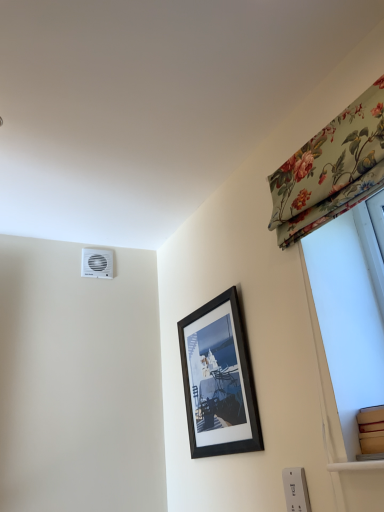
Image resolution: width=384 pixels, height=512 pixels. What do you see at coordinates (296, 490) in the screenshot?
I see `white plastic electric outlet at lower right` at bounding box center [296, 490].

In order to face white plastic air conditioning unit at upper left, should I rotate leftwards or rightwards?

To align with it, rotate left about 12.483°.

What do you see at coordinates (218, 380) in the screenshot? Image resolution: width=384 pixels, height=512 pixels. I see `black matte picture frame at center` at bounding box center [218, 380].

Find the location of a particular element. The width and height of the screenshot is (384, 512). floral fabric curtain at upper right is located at coordinates (331, 170).

Identify the location of white plastic electric outlet at lower right. (296, 490).

Can you tell me how much floral fabric curtain at upper right and black matte picture frame at center differ in facing direction?

The angular difference between floral fabric curtain at upper right and black matte picture frame at center is 0.0802 degrees.

Is floral fabric curtain at upper right positioned beyond the bounds of black matte picture frame at center?

Yes, floral fabric curtain at upper right is not within black matte picture frame at center.

Does floral fabric curtain at upper right come behind black matte picture frame at center?

No, floral fabric curtain at upper right is in front of black matte picture frame at center.

From the image's perspective, does floral fabric curtain at upper right appear higher than white plastic air conditioning unit at upper left?

Yes, from the image's perspective, floral fabric curtain at upper right is over white plastic air conditioning unit at upper left.

Which of these two, floral fabric curtain at upper right or white plastic air conditioning unit at upper left, is bigger?

floral fabric curtain at upper right is bigger.

Where is `air conditioning that appears on the left of floral fabric curtain at upper right`? The image size is (384, 512). air conditioning that appears on the left of floral fabric curtain at upper right is located at coordinates (97, 263).

Is point (220, 438) closer to camera compared to point (296, 490)?

No, (220, 438) is behind (296, 490).

Is white plastic electric outlet at lower right at the back of black matte picture frame at center?

That's not correct — black matte picture frame at center is not looking away from white plastic electric outlet at lower right.

Is black matte picture frame at center to the left or to the right of white plastic electric outlet at lower right in the image?

black matte picture frame at center is to the left of white plastic electric outlet at lower right.

Is white plastic electric outlet at lower right directly adjacent to white plastic air conditioning unit at upper left?

white plastic electric outlet at lower right is not next to white plastic air conditioning unit at upper left, and they're not touching.

Is white plastic electric outlet at lower right further to the viewer compared to white plastic air conditioning unit at upper left?

No.

Which is more to the right, white plastic electric outlet at lower right or white plastic air conditioning unit at upper left?

white plastic electric outlet at lower right is more to the right.

Considering the sizes of white plastic electric outlet at lower right and white plastic air conditioning unit at upper left in the image, is white plastic electric outlet at lower right wider or thinner than white plastic air conditioning unit at upper left?

white plastic electric outlet at lower right is thinner than white plastic air conditioning unit at upper left.

Consider the image. Considering the sizes of objects white plastic air conditioning unit at upper left and white plastic electric outlet at lower right in the image provided, who is thinner, white plastic air conditioning unit at upper left or white plastic electric outlet at lower right?

white plastic electric outlet at lower right is thinner.

This screenshot has height=512, width=384. I want to click on air conditioning behind the white plastic electric outlet at lower right, so click(97, 263).

Looking at the image, does white plastic air conditioning unit at upper left seem bigger or smaller compared to white plastic electric outlet at lower right?

Clearly, white plastic air conditioning unit at upper left is larger in size than white plastic electric outlet at lower right.

Which point is more forward, (95, 272) or (289, 223)?

The point (289, 223) is in front.

Is white plastic air conditioning unit at upper left in contact with floral fabric curtain at upper right?

→ No, white plastic air conditioning unit at upper left is not with floral fabric curtain at upper right.

Is white plastic air conditioning unit at upper left facing towards floral fabric curtain at upper right?

Yes, white plastic air conditioning unit at upper left faces towards floral fabric curtain at upper right.

Could you measure the distance between white plastic air conditioning unit at upper left and floral fabric curtain at upper right?

white plastic air conditioning unit at upper left and floral fabric curtain at upper right are 1.26 meters apart.

Considering the sizes of objects white plastic electric outlet at lower right and floral fabric curtain at upper right in the image provided, who is thinner, white plastic electric outlet at lower right or floral fabric curtain at upper right?

With smaller width is white plastic electric outlet at lower right.

Where is `curtain that appears on the right of white plastic electric outlet at lower right`? curtain that appears on the right of white plastic electric outlet at lower right is located at coordinates (331, 170).

Which is in front, white plastic electric outlet at lower right or floral fabric curtain at upper right?

floral fabric curtain at upper right is closer to the camera.

Is point (291, 496) behind point (382, 144)?

Yes, point (291, 496) is farther from viewer.

Locate an element on the screen. Image resolution: width=384 pixels, height=512 pixels. curtain that appears on the right of black matte picture frame at center is located at coordinates [x=331, y=170].

This screenshot has width=384, height=512. Find the location of `air conditioning positioned vertically above the floral fabric curtain at upper right (from a real-world perspective)`. air conditioning positioned vertically above the floral fabric curtain at upper right (from a real-world perspective) is located at coordinates (97, 263).

Looking at the image, which one is located closer to white plastic electric outlet at lower right, black matte picture frame at center or floral fabric curtain at upper right?

Among the two, black matte picture frame at center is located nearer to white plastic electric outlet at lower right.

When comparing their distances from black matte picture frame at center, does floral fabric curtain at upper right or white plastic air conditioning unit at upper left seem further?

white plastic air conditioning unit at upper left is positioned further to the anchor black matte picture frame at center.

Consider the image. Estimate the real-world distances between objects in this image. Which object is closer to white plastic electric outlet at lower right, floral fabric curtain at upper right or black matte picture frame at center?

black matte picture frame at center is closer to white plastic electric outlet at lower right.

Considering their positions, is white plastic air conditioning unit at upper left positioned closer to white plastic electric outlet at lower right than black matte picture frame at center?

Based on the image, black matte picture frame at center appears to be nearer to white plastic electric outlet at lower right.

Looking at the image, which one is located further to floral fabric curtain at upper right, black matte picture frame at center or white plastic air conditioning unit at upper left?

Among the two, white plastic air conditioning unit at upper left is located further to floral fabric curtain at upper right.

From the image, which object appears to be nearer to floral fabric curtain at upper right, black matte picture frame at center or white plastic electric outlet at lower right?

black matte picture frame at center is positioned closer to the anchor floral fabric curtain at upper right.

Based on their spatial positions, is black matte picture frame at center or white plastic air conditioning unit at upper left further from white plastic electric outlet at lower right?

Among the two, white plastic air conditioning unit at upper left is located further to white plastic electric outlet at lower right.

Looking at this image, estimate the real-world distances between objects in this image. Which object is closer to white plastic air conditioning unit at upper left, white plastic electric outlet at lower right or black matte picture frame at center?

black matte picture frame at center is closer to white plastic air conditioning unit at upper left.

At what (x,y) coordinates should I click in order to perform the action: click on picture frame between floral fabric curtain at upper right and white plastic electric outlet at lower right from top to bottom. Please return your answer as a coordinate pair (x, y). Looking at the image, I should click on (218, 380).

Locate an element on the screen. picture frame positioned between floral fabric curtain at upper right and white plastic air conditioning unit at upper left from near to far is located at coordinates (218, 380).

In order to click on electric outlet between floral fabric curtain at upper right and white plastic air conditioning unit at upper left along the z-axis in this screenshot , I will do `click(296, 490)`.

Find the location of a particular element. picture frame positioned between white plastic electric outlet at lower right and white plastic air conditioning unit at upper left from near to far is located at coordinates (218, 380).